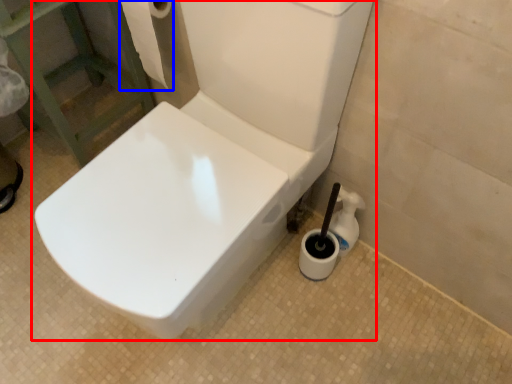
Question: Which object is closer to the camera taking this photo, toilet (highlighted by a red box) or toilet paper (highlighted by a blue box)?

Choices:
 (A) toilet
 (B) toilet paper

Answer: (A)